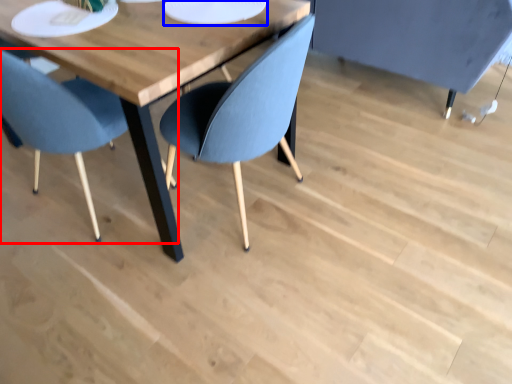
Question: Which object appears farthest to the camera in this image, chair (highlighted by a red box) or paper plate (highlighted by a blue box)?

Choices:
 (A) chair
 (B) paper plate

Answer: (B)